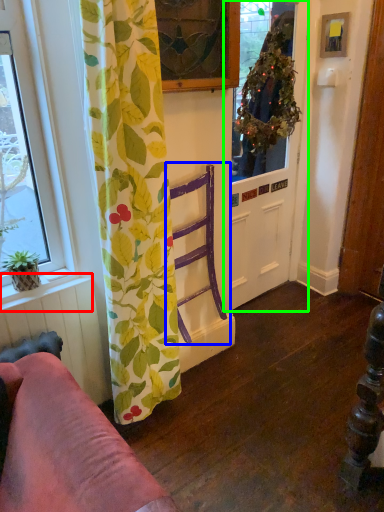
Question: Considering the real-world distances, which object is closest to window sill (highlighted by a red box)? armchair (highlighted by a blue box) or door (highlighted by a green box).

Choices:
 (A) armchair
 (B) door

Answer: (A)